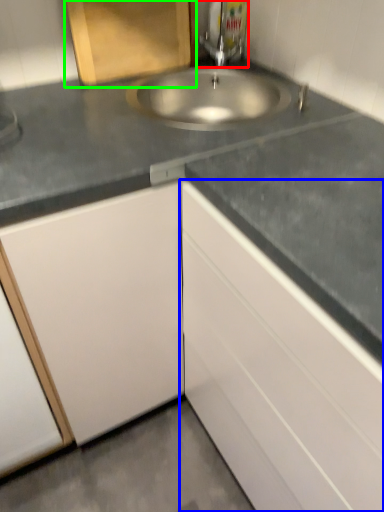
Question: Which is farther away from tap (highlighted by a red box)? cabinetry (highlighted by a blue box) or cabinetry (highlighted by a green box)?

Choices:
 (A) cabinetry
 (B) cabinetry

Answer: (A)